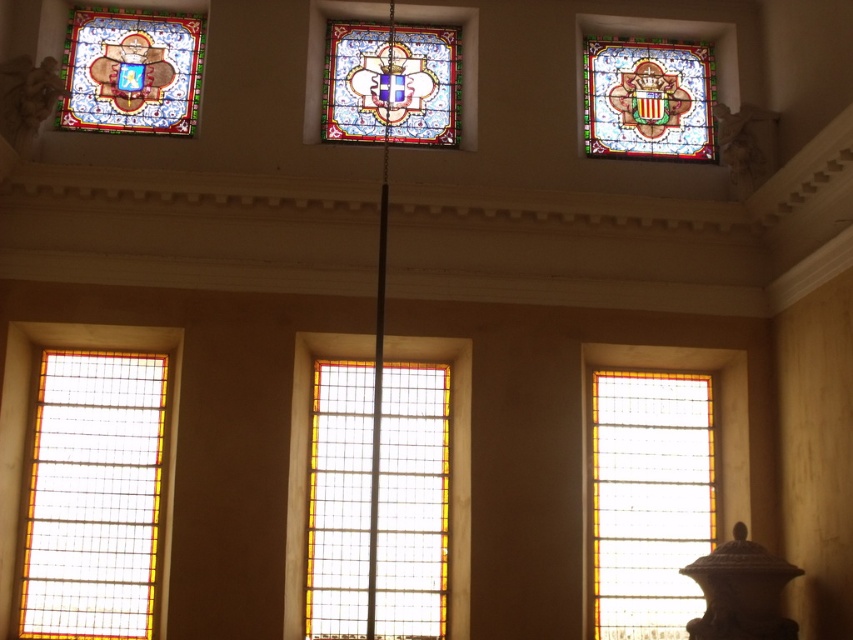
Is stained glass at upper left to the right of stained glass window at center from the viewer's perspective?

Incorrect, stained glass at upper left is not on the right side of stained glass window at center.

Is stained glass at upper left shorter than stained glass window at center?

Incorrect, stained glass at upper left's height does not fall short of stained glass window at center's.

Find the location of a particular element. This screenshot has width=853, height=640. stained glass at upper left is located at coordinates (131, 70).

Between clear glass window at center and stained glass at upper left, which one has more height?

With more height is clear glass window at center.

Who is lower down, clear glass window at center or stained glass at upper left?

clear glass window at center is lower down.

Does point (338, 499) come in front of point (184, 42)?

Yes, point (338, 499) is closer to viewer.

The width and height of the screenshot is (853, 640). I want to click on clear glass window at center, so click(x=413, y=500).

Is clear glass window at lower left to the right of stained glass window at center from the viewer's perspective?

No, clear glass window at lower left is not to the right of stained glass window at center.

Can you confirm if clear glass window at lower left is taller than stained glass window at center?

Indeed, clear glass window at lower left has a greater height compared to stained glass window at center.

Is point (77, 365) positioned in front of point (459, 35)?

Yes.

You are a GUI agent. You are given a task and a screenshot of the screen. Output one action in this format:
    pyautogui.click(x=<x>, y=<y>)
    Task: Click on the clear glass window at lower left
    The height and width of the screenshot is (640, 853).
    Given the screenshot: What is the action you would take?
    pyautogui.click(x=93, y=497)